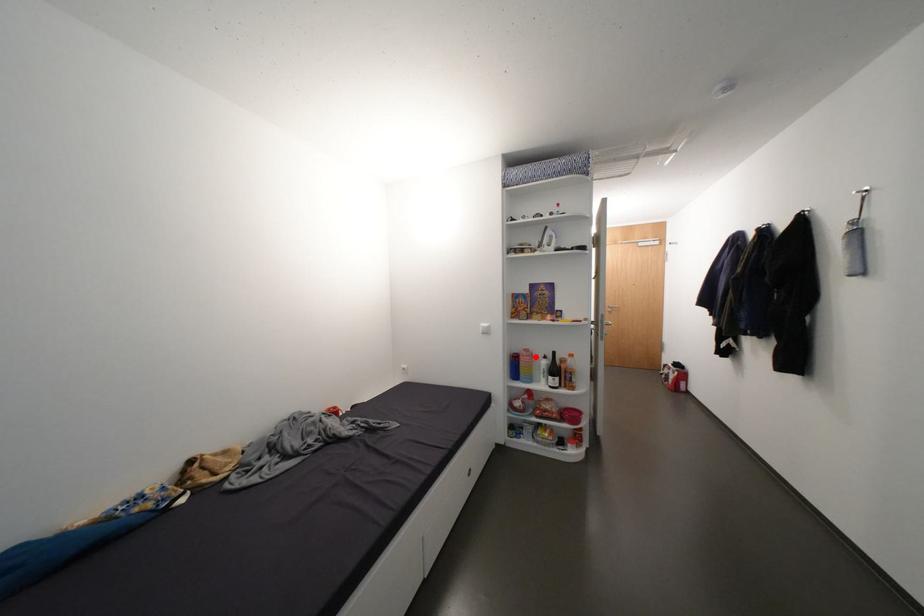
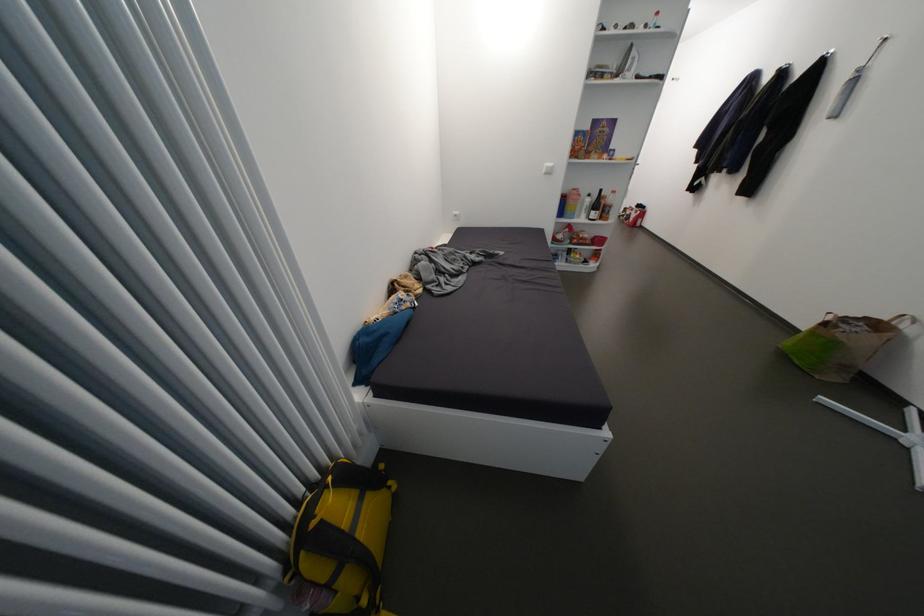
Question: I am providing you with two images of the same scene from different viewpoints. Given a red point in image1, look at the same physical point in image2. Is it:

Choices:
 (A) Closer to the viewpoint
 (B) Farther from the viewpoint

Answer: (A)